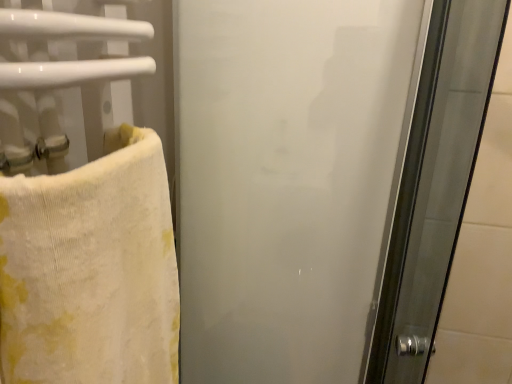
Question: Considering their positions, is frosted glass screen door at center located in front of or behind yellow cotton towel at left?

Choices:
 (A) behind
 (B) front

Answer: (A)

Question: In terms of height, does frosted glass screen door at center look taller or shorter compared to yellow cotton towel at left?

Choices:
 (A) tall
 (B) short

Answer: (A)

Question: Considering the positions of frosted glass screen door at center and yellow cotton towel at left in the image, is frosted glass screen door at center bigger or smaller than yellow cotton towel at left?

Choices:
 (A) big
 (B) small

Answer: (A)

Question: Is yellow cotton towel at left taller or shorter than frosted glass screen door at center?

Choices:
 (A) tall
 (B) short

Answer: (B)

Question: Considering their positions, is yellow cotton towel at left located in front of or behind frosted glass screen door at center?

Choices:
 (A) behind
 (B) front

Answer: (B)

Question: Is yellow cotton towel at left to the left or to the right of frosted glass screen door at center in the image?

Choices:
 (A) right
 (B) left

Answer: (B)

Question: In terms of width, does yellow cotton towel at left look wider or thinner when compared to frosted glass screen door at center?

Choices:
 (A) thin
 (B) wide

Answer: (A)